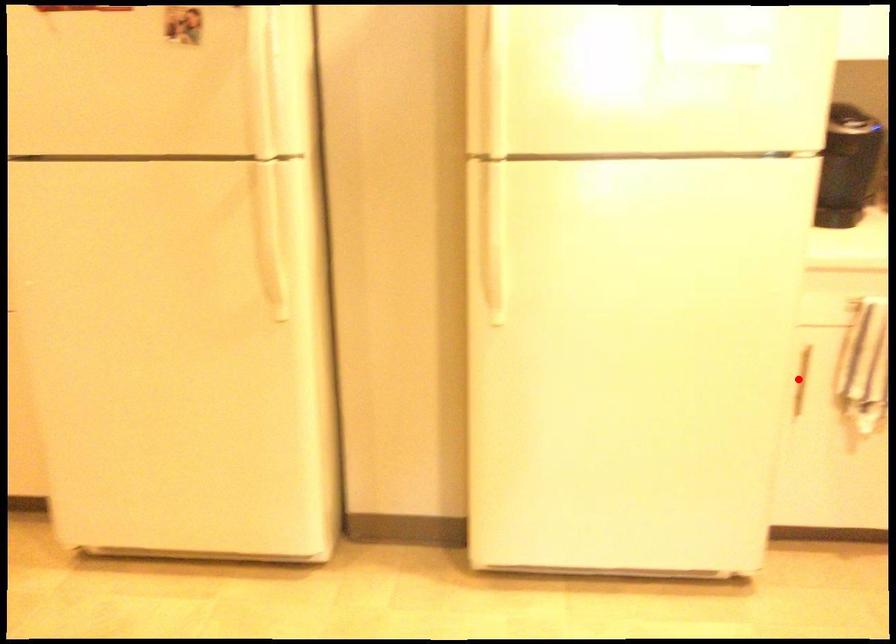
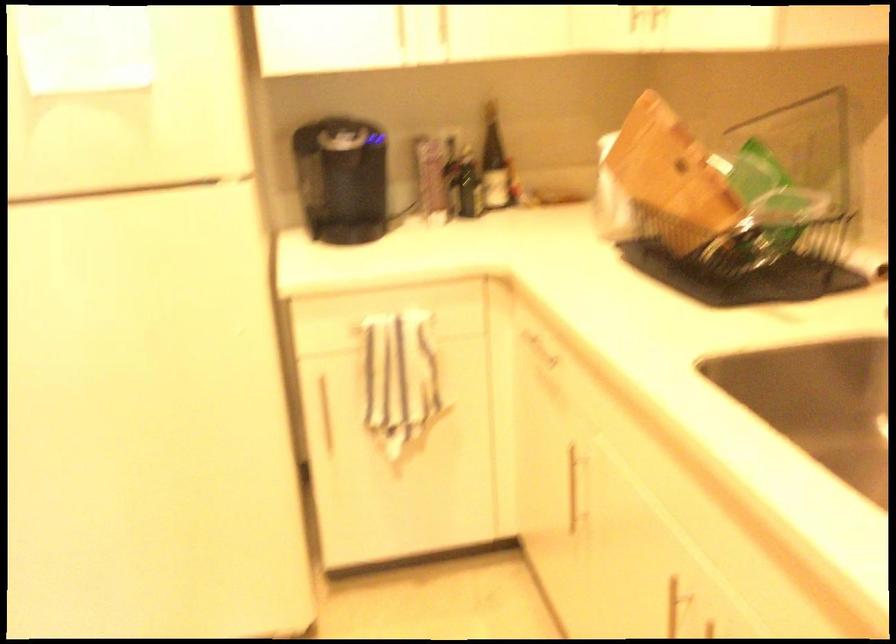
Where in the second image is the point corresponding to the highlighted location from the first image?

(323, 412)